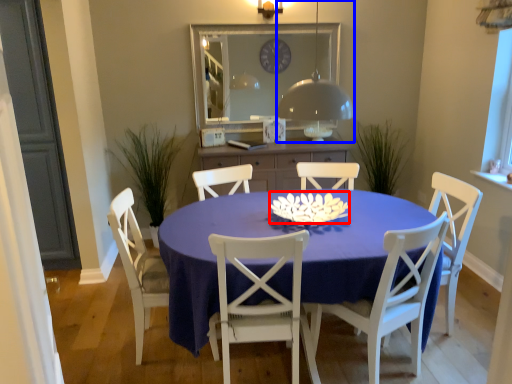
Question: Which object appears closest to the camera in this image, flower (highlighted by a red box) or lamp (highlighted by a blue box)?

Choices:
 (A) flower
 (B) lamp

Answer: (B)